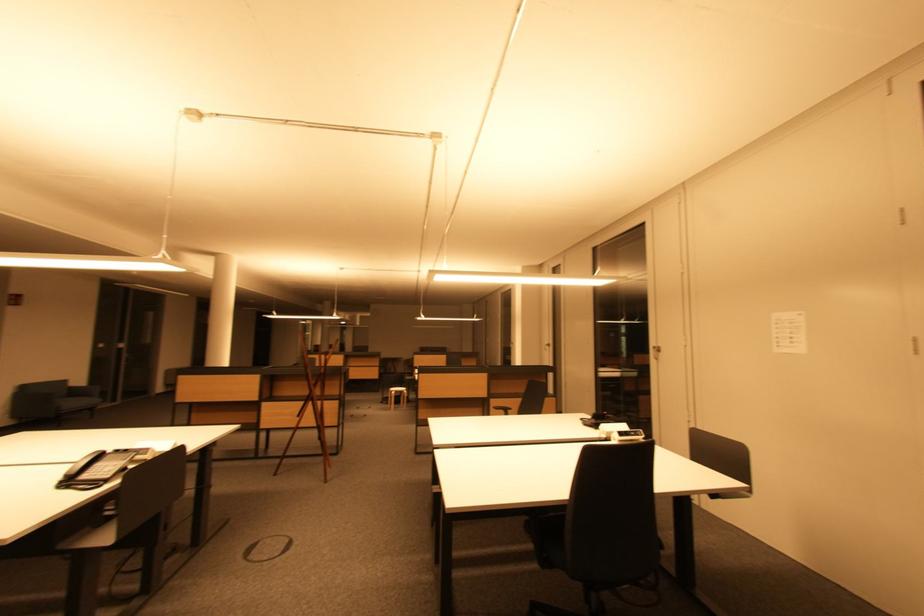
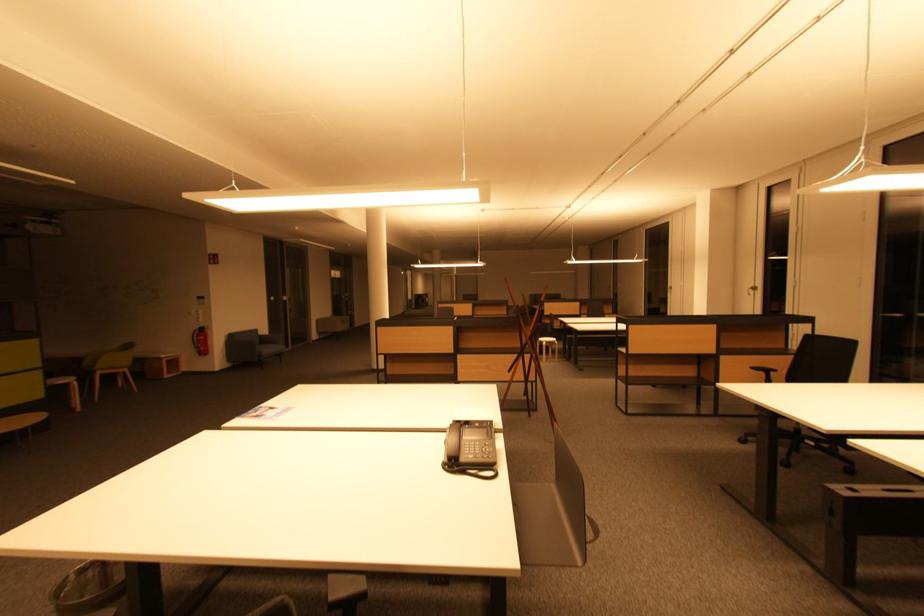
Where in the second image is the point corresponding to the point at 76,406 from the first image?

(272, 352)